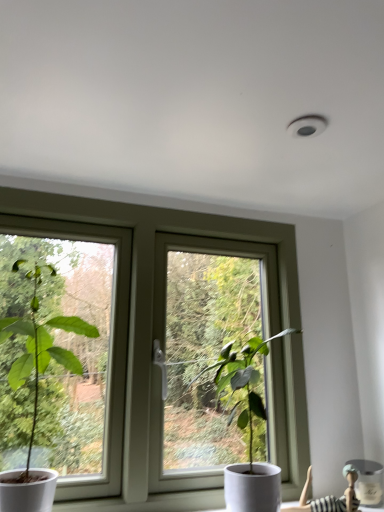
Question: Does green matte plant at left, the second houseplant in the right-to-left sequence, have a larger size compared to striped fabric doll at lower right?

Choices:
 (A) no
 (B) yes

Answer: (B)

Question: Is green matte plant at left, which is the 1th houseplant in left-to-right order, positioned far away from striped fabric doll at lower right?

Choices:
 (A) yes
 (B) no

Answer: (B)

Question: From the image's perspective, is green matte plant at left, which is the 1th houseplant in left-to-right order, beneath striped fabric doll at lower right?

Choices:
 (A) yes
 (B) no

Answer: (B)

Question: Is green matte plant at left, the second houseplant in the right-to-left sequence, aimed at striped fabric doll at lower right?

Choices:
 (A) yes
 (B) no

Answer: (B)

Question: Is green matte plant at left, which is the 1th houseplant in left-to-right order, shorter than striped fabric doll at lower right?

Choices:
 (A) yes
 (B) no

Answer: (B)

Question: From a real-world perspective, is green matte plant at center, arranged as the 2th houseplant when viewed from the left, physically located above or below white plastic window at center?

Choices:
 (A) above
 (B) below

Answer: (B)

Question: Choose the correct answer: Is green matte plant at center, arranged as the 2th houseplant when viewed from the left, inside white plastic window at center or outside it?

Choices:
 (A) inside
 (B) outside

Answer: (B)

Question: Based on their sizes in the image, would you say green matte plant at center, which is the first houseplant from right to left, is bigger or smaller than white plastic window at center?

Choices:
 (A) big
 (B) small

Answer: (B)

Question: Looking at their shapes, would you say green matte plant at center, arranged as the 2th houseplant when viewed from the left, is wider or thinner than white plastic window at center?

Choices:
 (A) wide
 (B) thin

Answer: (A)

Question: In terms of height, does green matte plant at left, which is the 1th houseplant in left-to-right order, look taller or shorter compared to white plastic window at center?

Choices:
 (A) short
 (B) tall

Answer: (A)

Question: Is green matte plant at left, which is the 1th houseplant in left-to-right order, wider or thinner than white plastic window at center?

Choices:
 (A) thin
 (B) wide

Answer: (B)

Question: Looking at the image, does green matte plant at left, the second houseplant in the right-to-left sequence, seem bigger or smaller compared to white plastic window at center?

Choices:
 (A) big
 (B) small

Answer: (B)

Question: Would you say green matte plant at left, which is the 1th houseplant in left-to-right order, is to the left or to the right of white plastic window at center in the picture?

Choices:
 (A) right
 (B) left

Answer: (B)

Question: Do you think white ceramic vase at lower right is within striped fabric doll at lower right, or outside of it?

Choices:
 (A) outside
 (B) inside

Answer: (A)

Question: From the image's perspective, is white ceramic vase at lower right positioned above or below striped fabric doll at lower right?

Choices:
 (A) above
 (B) below

Answer: (B)